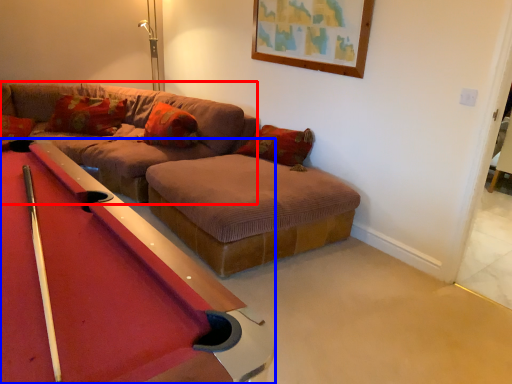
Question: Which of the following is the farthest to the observer, couch (highlighted by a red box) or billiard table (highlighted by a blue box)?

Choices:
 (A) couch
 (B) billiard table

Answer: (A)